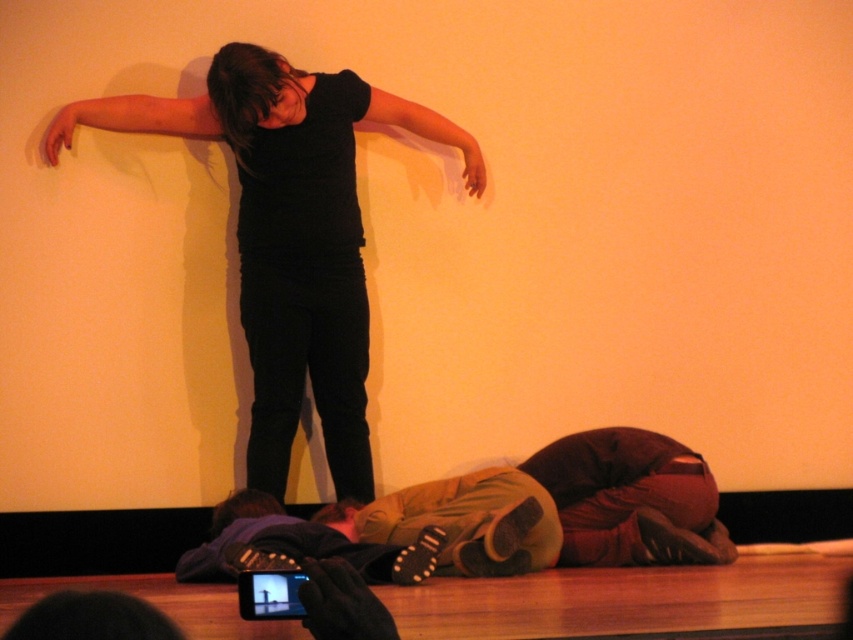
You are standing on the stage and need to place a small plant pot that is 0.5 meters wide. Where should you place it so that it doesn not block the performer who is standing in the center? Please refer to the coordinates of the brown fabric sleeping bag at lower center for guidance.

The brown fabric sleeping bag at lower center is located at coordinates point (569,504). To avoid blocking the performer, place the plant pot away from the center area, perhaps near the edges of the stage but not overlapping with the sleeping bag or the performer.

You are an artist analyzing the spatial relationships in the image. You notice the black matte arm at upper center and the matte black hand at upper left. Which object has a greater width?

The black matte arm at upper center has a greater width than the matte black hand at upper left.